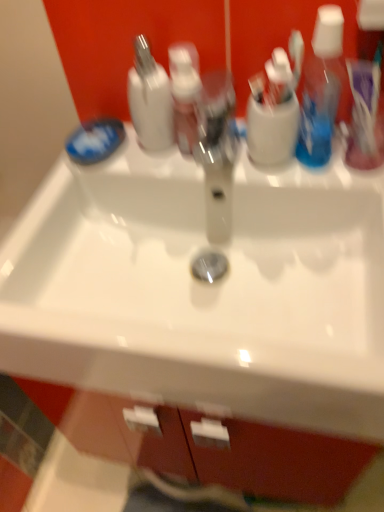
Image resolution: width=384 pixels, height=512 pixels. Identify the location of vacant region to the left of translucent pink pump bottle at center. (114, 172).